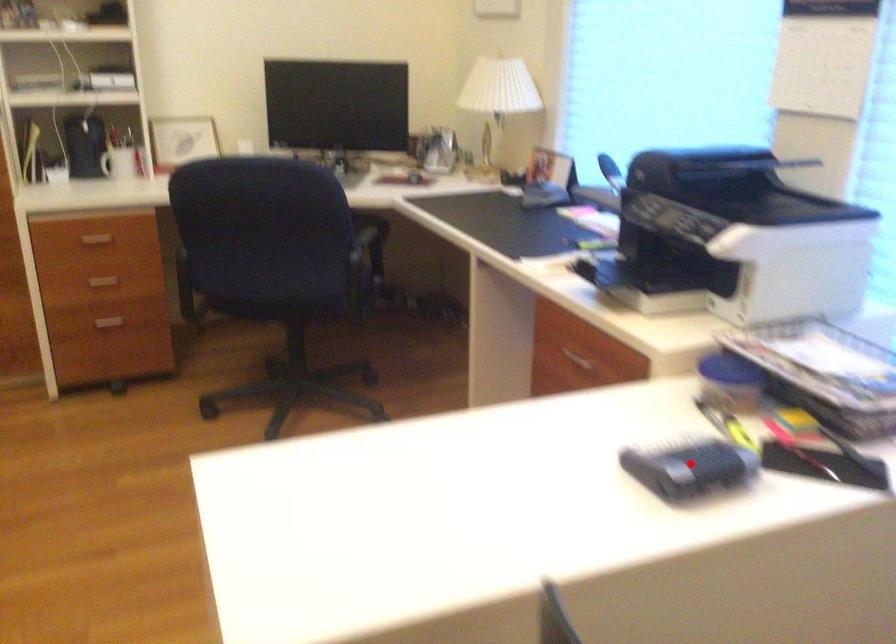
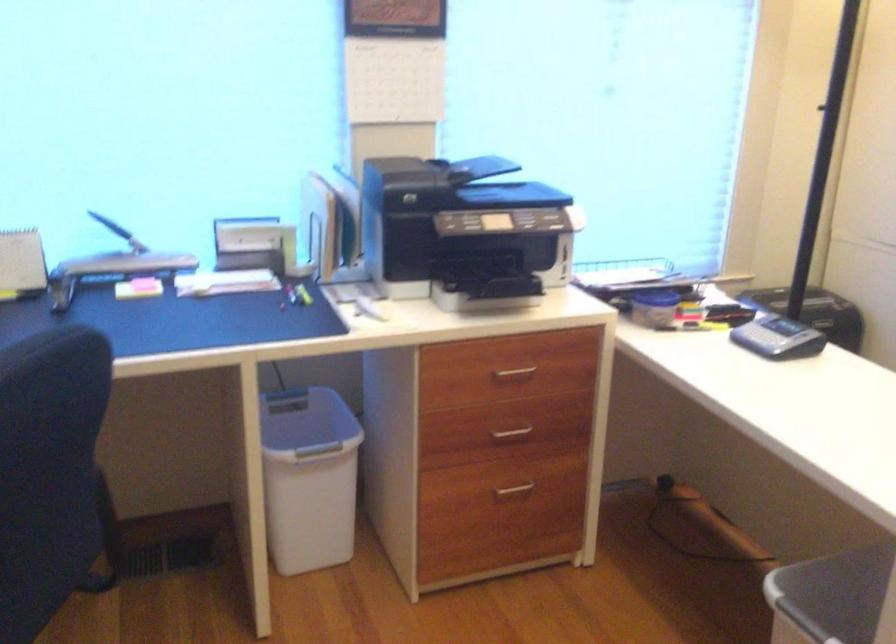
Question: I am providing you with two images of the same scene from different viewpoints. Given a red point in image1, look at the same physical point in image2. Is it:

Choices:
 (A) Closer to the viewpoint
 (B) Farther from the viewpoint

Answer: (B)